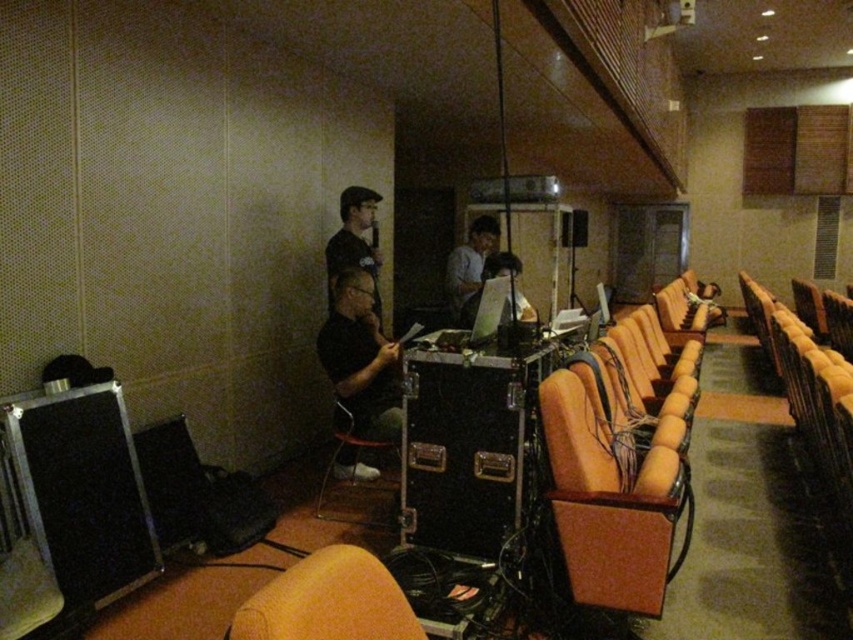
Is point (625, 525) farther from camera compared to point (469, 307)?

No, (625, 525) is in front of (469, 307).

Where is `orange fabric chair at lower right`? orange fabric chair at lower right is located at coordinates (610, 502).

The image size is (853, 640). Find the location of `orange fabric chair at lower right`. orange fabric chair at lower right is located at coordinates 610,502.

Can you confirm if metallic black speaker at lower left is thinner than matte black shirt at center?

Incorrect, metallic black speaker at lower left's width is not less than matte black shirt at center's.

From the picture: Is metallic black speaker at lower left shorter than matte black shirt at center?

Correct, metallic black speaker at lower left is not as tall as matte black shirt at center.

What do you see at coordinates (83, 492) in the screenshot?
I see `metallic black speaker at lower left` at bounding box center [83, 492].

Find the location of a particular element. The image size is (853, 640). metallic black speaker at lower left is located at coordinates tap(83, 492).

Measure the distance from metallic black speaker at lower left to light blue shirt at center.

The distance of metallic black speaker at lower left from light blue shirt at center is 8.67 feet.

Does metallic black speaker at lower left come behind light blue shirt at center?

No, it is in front of light blue shirt at center.

Locate an element on the screen. Image resolution: width=853 pixels, height=640 pixels. metallic black speaker at lower left is located at coordinates (83, 492).